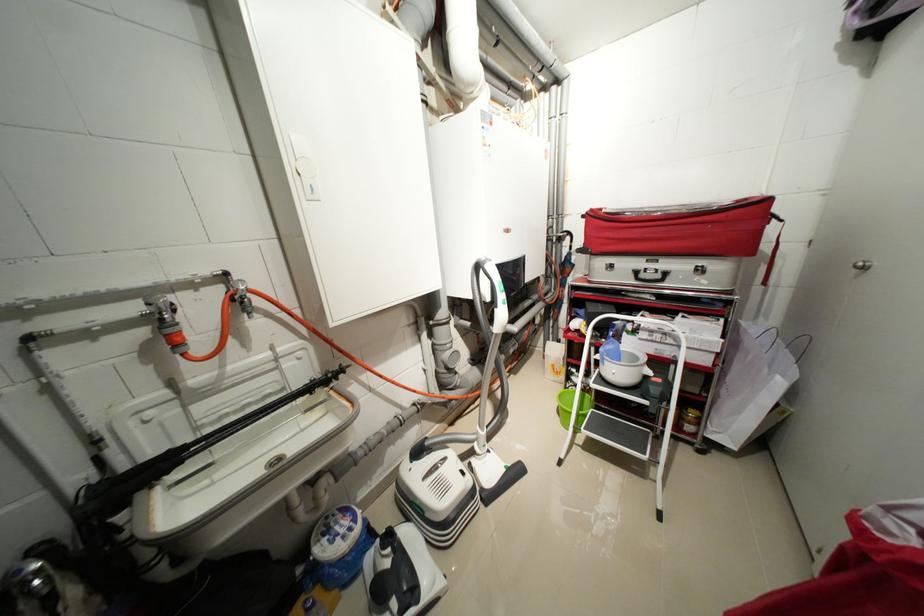
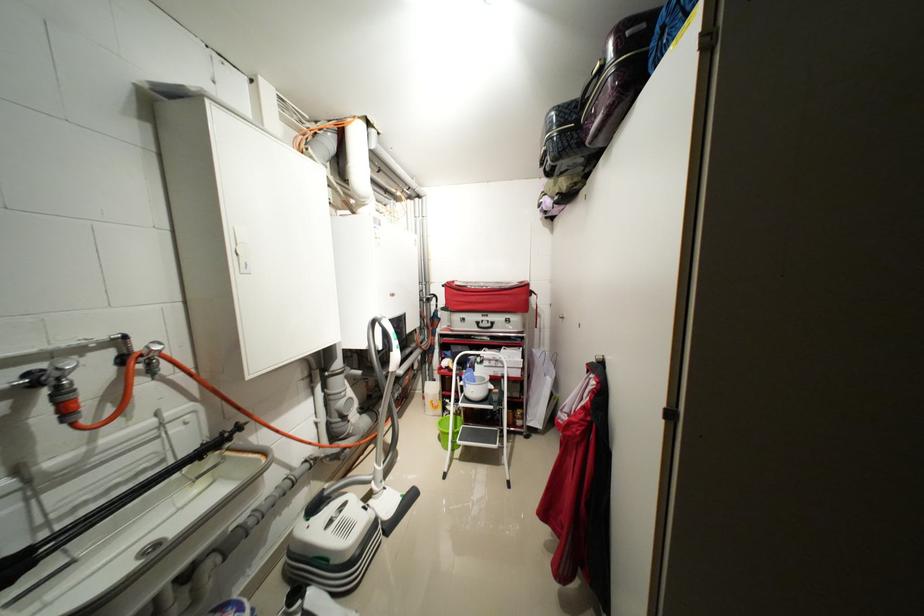
Locate, in the second image, the point that corresponds to (x=599, y=211) in the first image.

(455, 284)